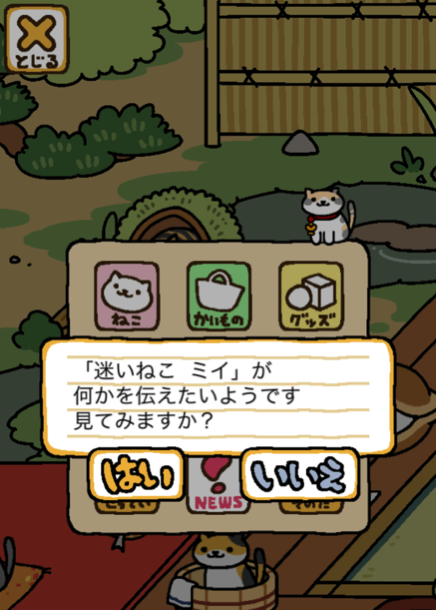
Image resolution: width=436 pixels, height=610 pixels. I want to click on hand towel, so point(184,593).